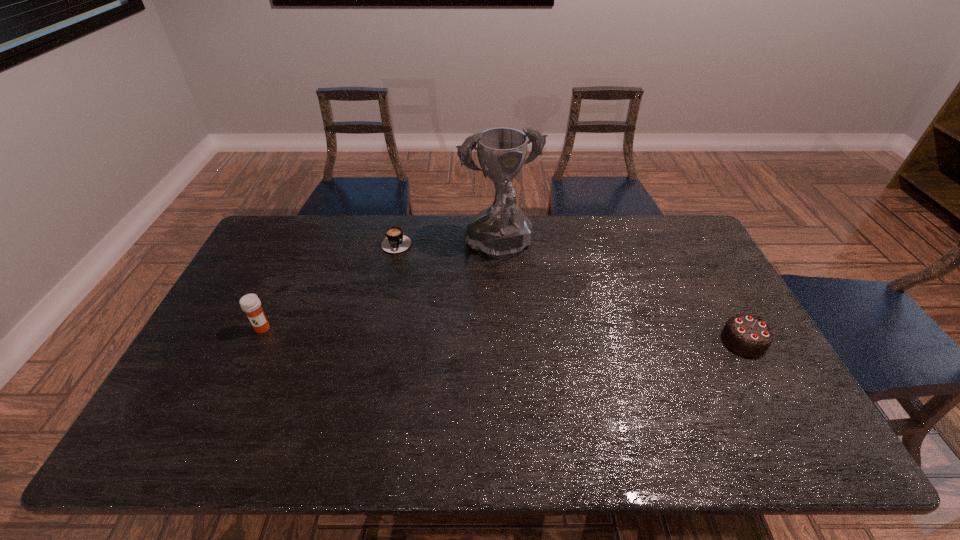
Where is `free space on the desktop that is between the leftmost object and the second shortest object and is positioned on the side with emblem of the award`? free space on the desktop that is between the leftmost object and the second shortest object and is positioned on the side with emblem of the award is located at coordinates (540, 335).

I want to click on vacant spot on the desktop that is between the medicine and the chocolate cake and is positioned with the handle on the side of the second object from left to right, so click(470, 334).